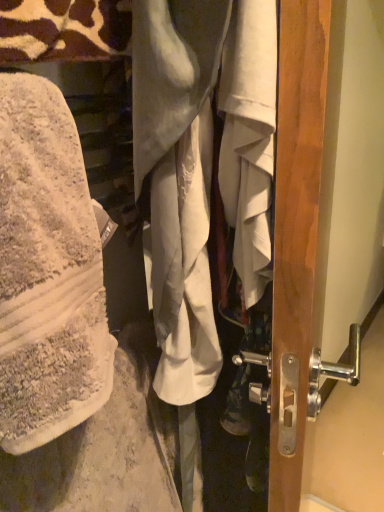
Question: Considering the positions of point (92, 29) and point (201, 15), is point (92, 29) closer or farther from the camera than point (201, 15)?

Choices:
 (A) closer
 (B) farther

Answer: (B)

Question: Is white cotton wrap at left, which is the 2th wrap from right to left, inside or outside of white cotton shirt at center, placed as the second wrap when sorted from left to right?

Choices:
 (A) outside
 (B) inside

Answer: (A)

Question: Is white cotton wrap at left, which appears as the first wrap when viewed from the left, taller or shorter than white cotton shirt at center, the first wrap positioned from the right?

Choices:
 (A) tall
 (B) short

Answer: (B)

Question: From a real-world perspective, is white cotton shirt at center, the first wrap positioned from the right, physically located above or below white cotton wrap at left, which is the 2th wrap from right to left?

Choices:
 (A) above
 (B) below

Answer: (B)

Question: Is white cotton shirt at center, the first wrap positioned from the right, situated inside white cotton wrap at left, which appears as the first wrap when viewed from the left, or outside?

Choices:
 (A) outside
 (B) inside

Answer: (A)

Question: From their relative heights in the image, would you say white cotton shirt at center, the first wrap positioned from the right, is taller or shorter than white cotton wrap at left, which is the 2th wrap from right to left?

Choices:
 (A) tall
 (B) short

Answer: (A)

Question: Is point (163, 25) positioned closer to the camera than point (216, 74)?

Choices:
 (A) closer
 (B) farther

Answer: (A)